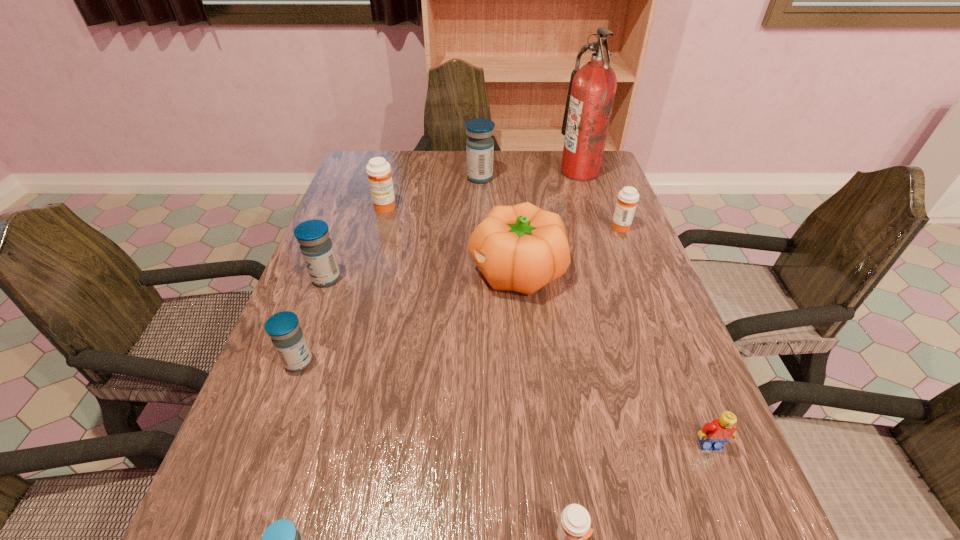
Locate an element on the screen. the second farthest orange medicine is located at coordinates (628, 197).

The height and width of the screenshot is (540, 960). Find the location of `the second nearest blue medicine`. the second nearest blue medicine is located at coordinates (283, 328).

Identify the location of the fifth farthest medicine. (283, 328).

The image size is (960, 540). Find the location of `the eighth farthest object`. the eighth farthest object is located at coordinates click(x=721, y=430).

Find the location of `Lego`. Lego is located at coordinates (721, 430).

This screenshot has width=960, height=540. In order to click on vacant position located on the front of the red fire extinguisher near the operation label in this screenshot , I will do `click(537, 172)`.

Where is `free space located 0.070m on the front of the red fire extinguisher near the operation label`? This screenshot has width=960, height=540. free space located 0.070m on the front of the red fire extinguisher near the operation label is located at coordinates (540, 172).

Locate an element on the screen. vacant space located on the front of the red fire extinguisher near the operation label is located at coordinates (485, 172).

Where is `free location located 0.120m on the left of the fifth medicine from left to right`? free location located 0.120m on the left of the fifth medicine from left to right is located at coordinates (429, 178).

You are a GUI agent. You are given a task and a screenshot of the screen. Output one action in this format:
    pyautogui.click(x=<x>, y=<y>)
    Task: Click on the free space located 0.230m on the carved face of the pumpkin
    The width and height of the screenshot is (960, 540).
    Given the screenshot: What is the action you would take?
    pyautogui.click(x=375, y=271)